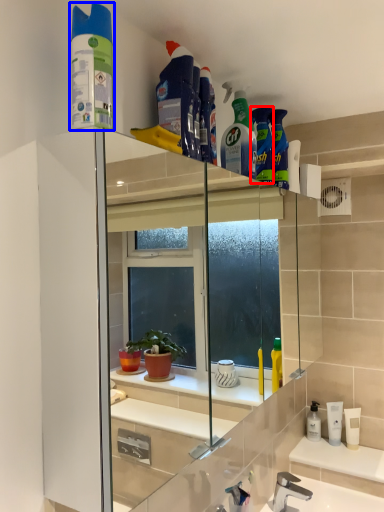
Question: Which object appears farthest to the camera in this image, cleaning product (highlighted by a red box) or cleaning product (highlighted by a blue box)?

Choices:
 (A) cleaning product
 (B) cleaning product

Answer: (A)